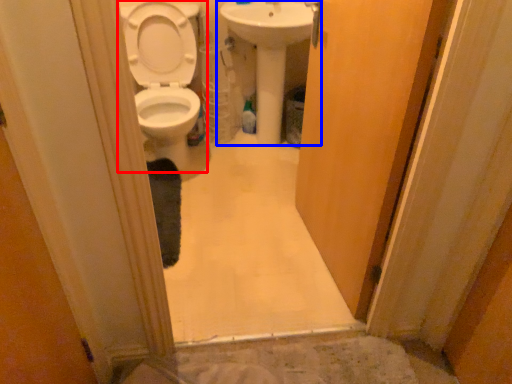
Question: Which object appears closest to the camera in this image, toilet (highlighted by a red box) or sink (highlighted by a blue box)?

Choices:
 (A) toilet
 (B) sink

Answer: (A)